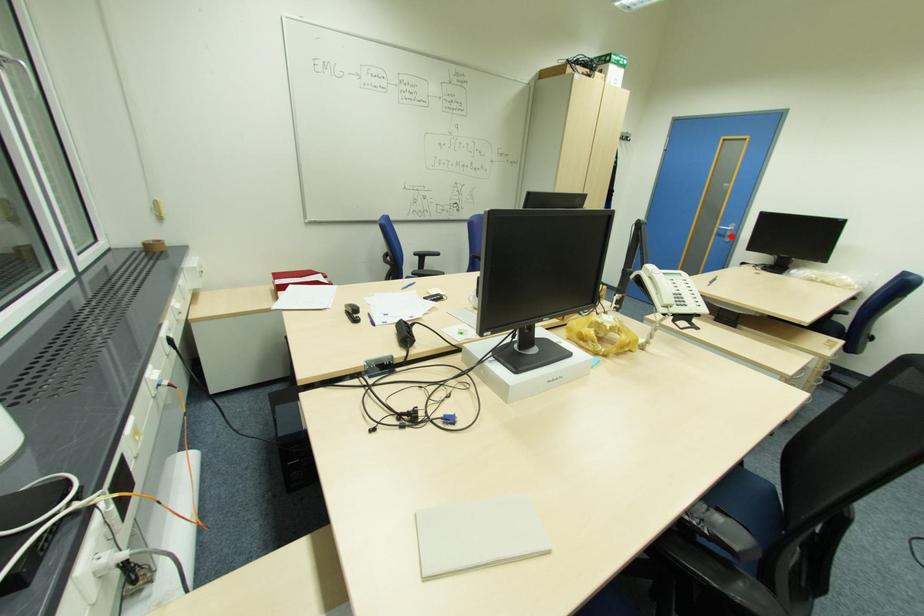
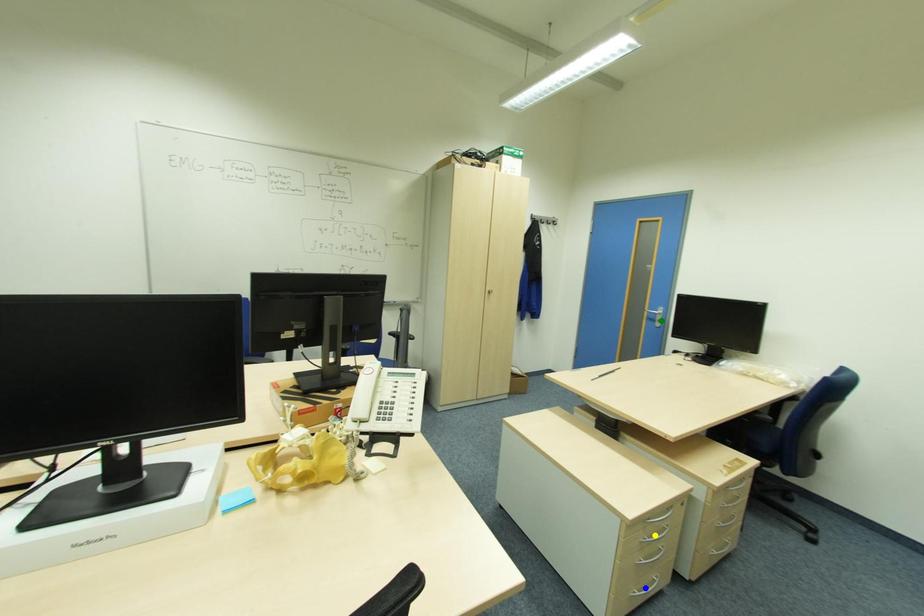
Question: I am providing you with two images of the same scene from different viewpoints. A red point is marked on the first image. You are given multiple points on the second image. Which spot in image 2 lines up with the point in image 1?

Choices:
 (A) green point
 (B) yellow point
 (C) blue point

Answer: (A)